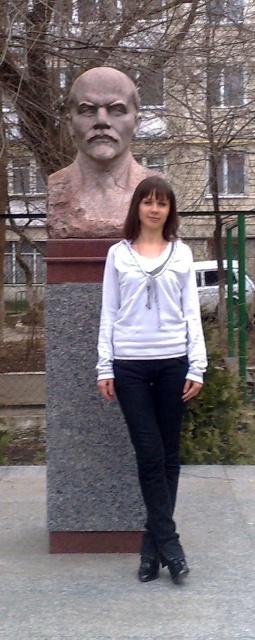
Question: Which of the following is the closest to the observer?

Choices:
 (A) (100, 356)
 (B) (155, 236)

Answer: (A)

Question: From the image, what is the correct spatial relationship of white cotton hoodie at center in relation to brown stone bust at center?

Choices:
 (A) below
 (B) above

Answer: (A)

Question: Which object appears closest to the camera in this image?

Choices:
 (A) brown stone bust at center
 (B) white matte shirt at center

Answer: (B)

Question: Which point is farther to the camera?

Choices:
 (A) white cotton hoodie at center
 (B) white matte shirt at center
 (C) brown stone bust at center

Answer: (C)

Question: Is white cotton hoodie at center smaller than white matte shirt at center?

Choices:
 (A) yes
 (B) no

Answer: (B)

Question: Can you confirm if white cotton hoodie at center is positioned below white matte shirt at center?

Choices:
 (A) yes
 (B) no

Answer: (A)